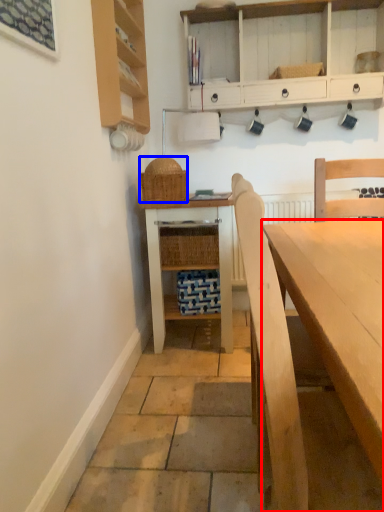
Question: Which of the following is the farthest to the observer, desk (highlighted by a red box) or picnic basket (highlighted by a blue box)?

Choices:
 (A) desk
 (B) picnic basket

Answer: (B)